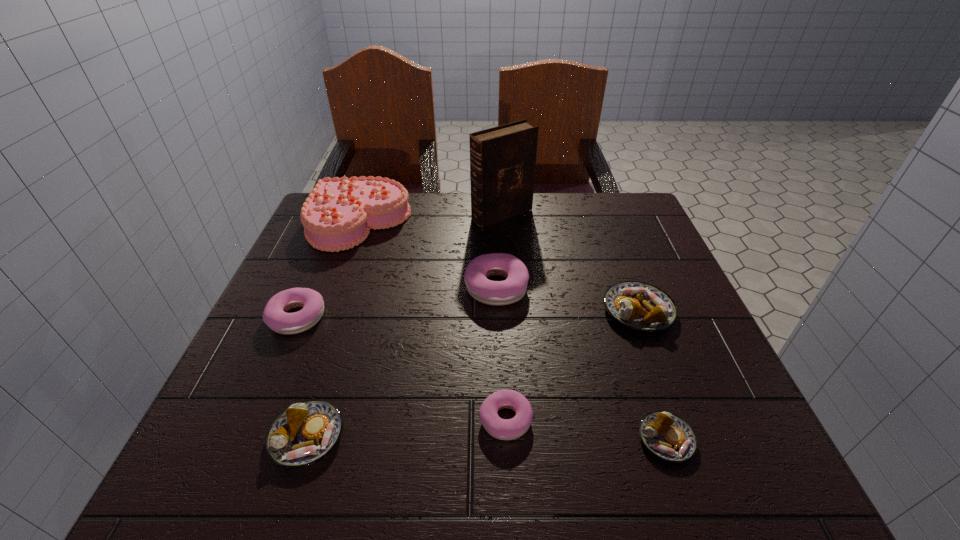
Locate an element on the screen. This screenshot has width=960, height=540. empty space that is in between the tallest object and the nearest pink pastry is located at coordinates (504, 317).

What are the coordinates of `free space between the smallest brown pastry and the second smallest brown pastry` in the screenshot? It's located at (487, 438).

The width and height of the screenshot is (960, 540). I want to click on empty space between the smallest pink pastry and the second smallest brown pastry, so click(x=406, y=428).

This screenshot has width=960, height=540. I want to click on free space that is in between the smallest pink pastry and the tallest object, so click(x=504, y=317).

At what (x,y) coordinates should I click in order to perform the action: click on vacant area that lies between the second smallest brown pastry and the biggest pink pastry. Please return your answer as a coordinate pair (x, y). The image size is (960, 540). Looking at the image, I should click on (401, 362).

At what (x,y) coordinates should I click in order to perform the action: click on free space between the smallest pink pastry and the biggest pink pastry. Please return your answer as a coordinate pair (x, y). Looking at the image, I should click on (501, 354).

Identify the location of free space between the second smallest pink pastry and the biggest brown pastry. The width and height of the screenshot is (960, 540). (468, 314).

This screenshot has height=540, width=960. Identify the location of free area in between the biggest pink pastry and the second smallest pink pastry. (396, 302).

Locate an element on the screen. The width and height of the screenshot is (960, 540). unoccupied area between the tallest object and the smallest brown pastry is located at coordinates (584, 327).

At what (x,y) coordinates should I click in order to perform the action: click on object that can be found as the seventh closest to the smallest brown pastry. Please return your answer as a coordinate pair (x, y). Image resolution: width=960 pixels, height=540 pixels. Looking at the image, I should click on (339, 213).